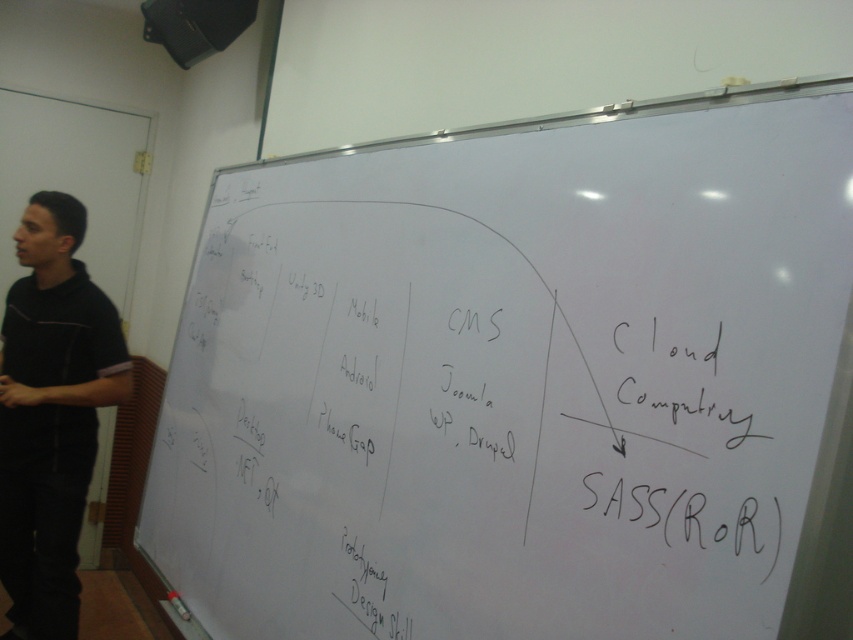
You are looking at the whiteboard in the classroom. There are two points marked on the whiteboard at coordinates point (422, 401) and point (86, 492). Which point appears closer to you?

Point (422, 401) is closer to the camera than point (86, 492), so it appears closer to you.

You are standing in the classroom and see the white matte board at center and the black fabric shirt at left. From your perspective, which object is positioned to the right?

The white matte board at center is positioned to the right of the black fabric shirt at left.